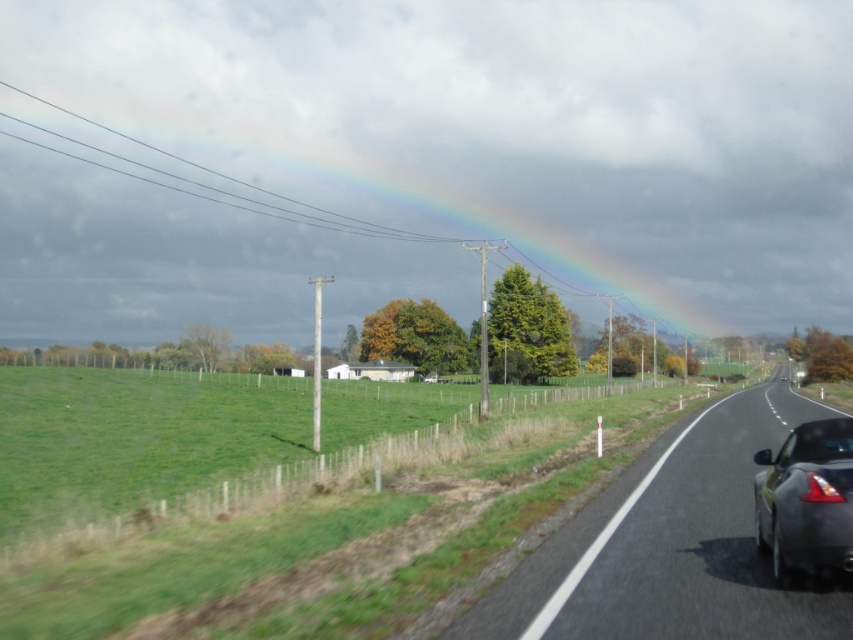
You are standing at the side of the road and see the shiny metallic car at right and the rainbow at upper center. If you want to take a photo of both objects in the same frame, would the car be closer to you than the rainbow?

The shiny metallic car at right is 214.15 meters away from the rainbow at upper center. However, without knowing the exact distances of each object from your position, it is impossible to determine if the car is closer to you than the rainbow.

You are a passenger in the dark car on the road. You look out the transparent glass car window at right and see the rainbow at upper center. Is the rainbow outside the car or inside the car?

The rainbow at upper center is outside the car because the transparent glass car window at right is behind it, meaning the rainbow is visible through the window and exists beyond the car.

You are a passenger in the car and looking out the transparent glass car window at right. Can you see the rainbow at upper center through the window?

The rainbow at upper center is taller than the transparent glass car window at right, so yes, the rainbow can be seen through the transparent glass car window at right as it extends beyond the window frame.